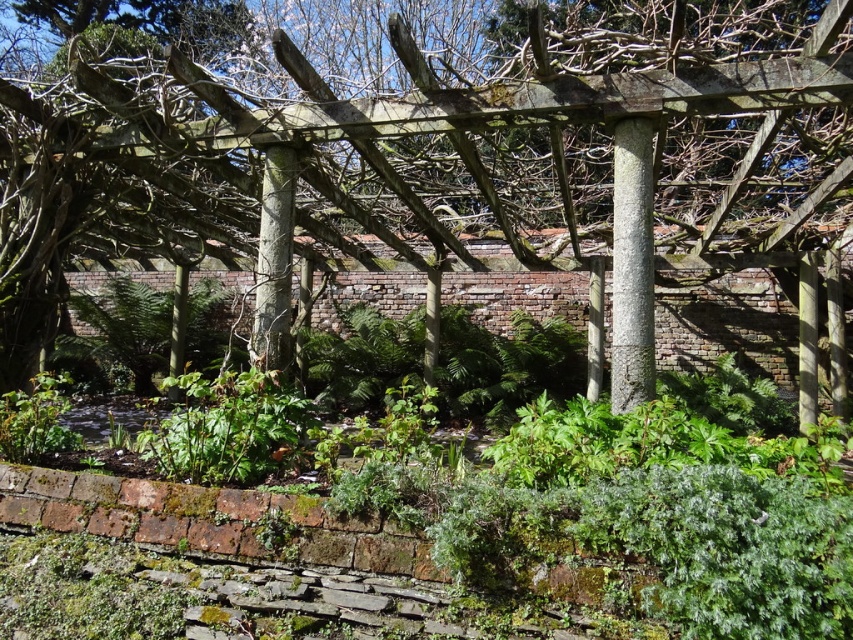
Who is more distant from viewer, (508, 262) or (640, 275)?

The point (508, 262) is behind.

Identify the location of smooth bark tree at center. (408, 160).